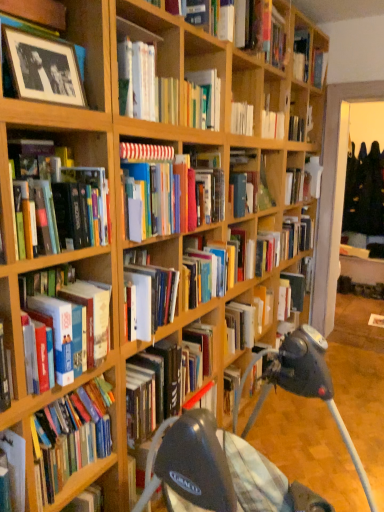
Question: Is black matte photo frame at upper left, arranged as the 4th book when viewed from the top, bigger or smaller than wooden bookshelf at lower left?

Choices:
 (A) big
 (B) small

Answer: (B)

Question: Do you think black matte photo frame at upper left, placed as the tenth book when sorted from bottom to top, is within wooden bookshelf at lower left, or outside of it?

Choices:
 (A) outside
 (B) inside

Answer: (A)

Question: Estimate the real-world distances between objects in this image. Which object is closer to the hardcover book at upper center, which is the second book from top to bottom?

Choices:
 (A) black plastic baby carriage at center
 (B) hardcover book at center, which is counted as the eighth book, starting from the bottom
 (C) multicolored hardcover books at center, marked as the 7th book in a bottom-to-top arrangement
 (D) black matte photo frame at upper left, arranged as the 4th book when viewed from the top
 (E) hardcover book at left, which is the 1th book in bottom-to-top order

Answer: (B)

Question: Estimate the real-world distances between objects in this image. Which object is farther from the multicolored hardcover books at center, arranged as the 7th book when viewed from the top?

Choices:
 (A) hardcover book at center, the ninth book positioned from the bottom
 (B) hardcover book at upper center, the 13th book ordered from the bottom
 (C) hardcover book at center, the 6th book when ordered from bottom to top
 (D) wooden bookshelf at lower left
 (E) hardcover book at left, arranged as the 4th book when ordered from the bottom

Answer: (B)